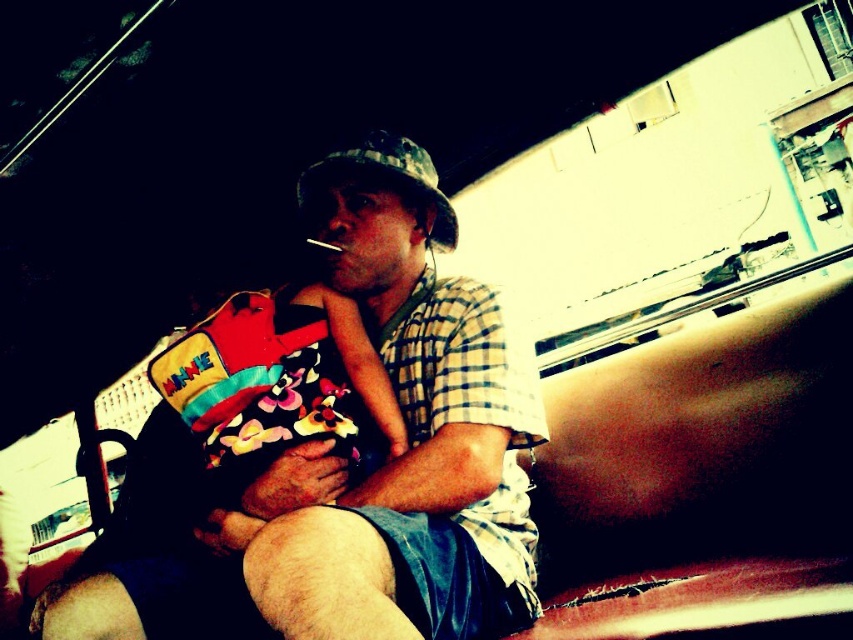
Is matte plaid shirt at center below camouflage fabric baseball hat at center?

Yes, matte plaid shirt at center is below camouflage fabric baseball hat at center.

Is point (537, 538) behind point (431, 234)?

No, it is not.

Locate an element on the screen. matte plaid shirt at center is located at coordinates (351, 458).

I want to click on matte plaid shirt at center, so click(351, 458).